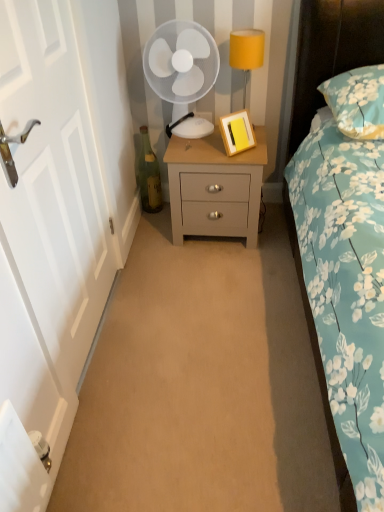
I want to click on vacant area that is situated to the right of white painted wood door at left, so click(195, 318).